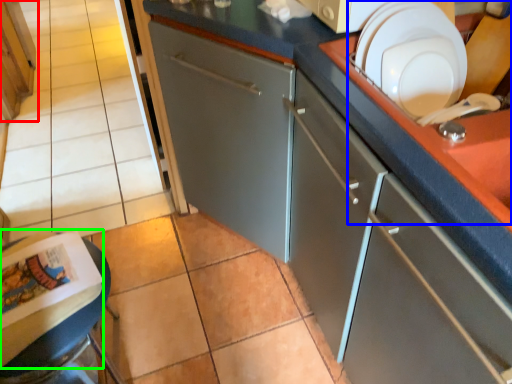
Question: Which object is the farthest from cabinetry (highlighted by a red box)? Choose among these: sink (highlighted by a blue box) or magazine (highlighted by a green box).

Choices:
 (A) sink
 (B) magazine

Answer: (A)